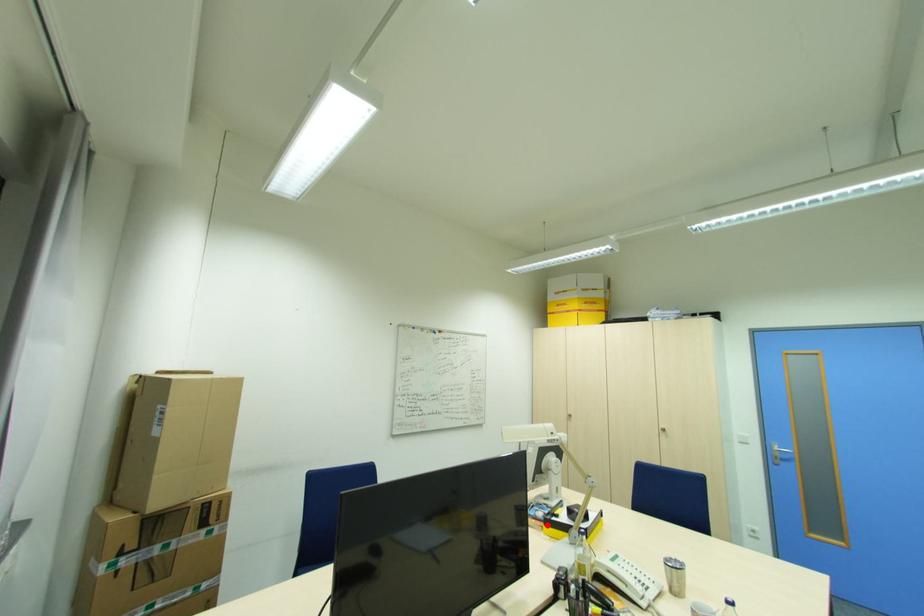
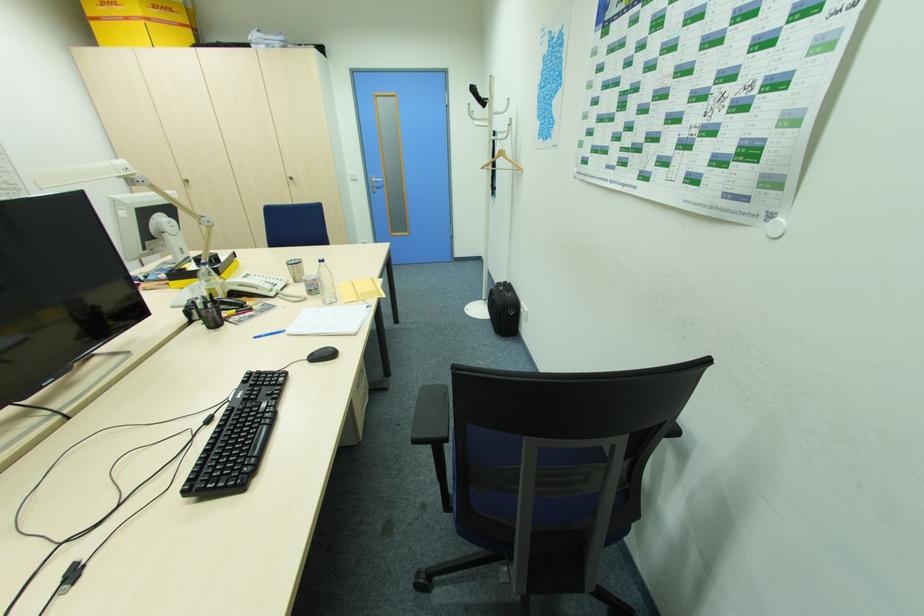
In the second image, find the point that corresponds to the highlighted location in the first image.

(173, 281)